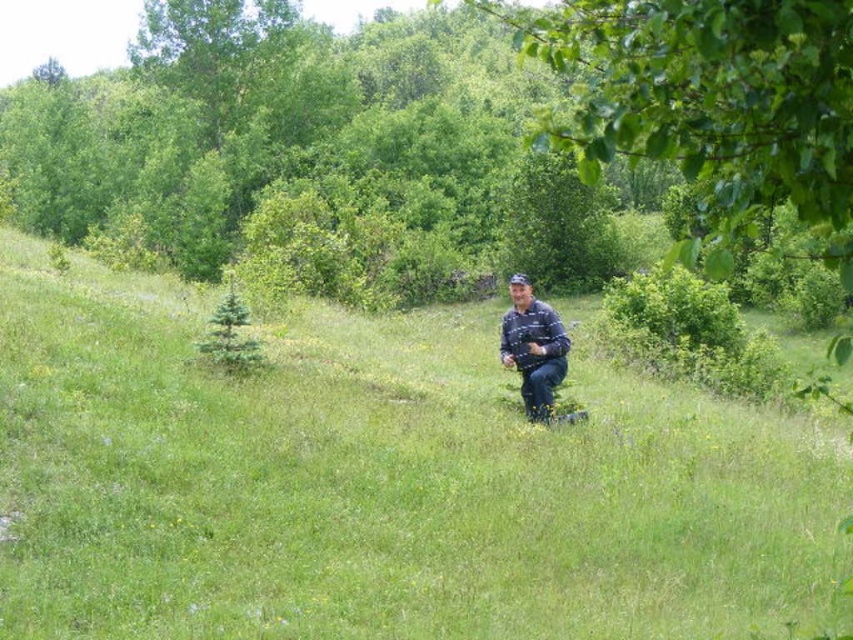
You are standing in the center of the field and see the green grassy at center and the blue denim jeans at center. Which one is taller?

The green grassy at center is taller than the blue denim jeans at center.

You are a photographer trying to capture a landscape photo. You need to ensure the green grassy at center and blue denim jeans at center are both in the frame. Which object should you focus on to ensure both are visible?

The green grassy at center is wider than the blue denim jeans at center, so focusing on the green grassy at center will ensure both are visible in the frame.